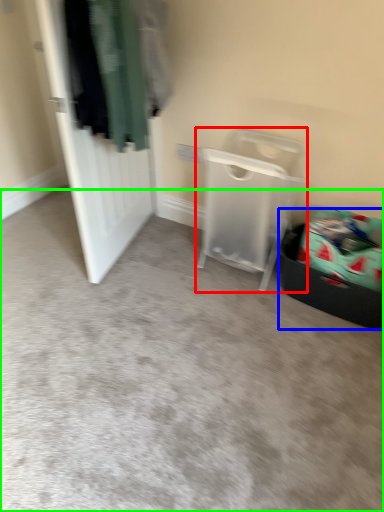
Question: Which object is positioned farthest from furniture (highlighted by a red box)? Select from laundry basket (highlighted by a blue box) and plain (highlighted by a green box).

Choices:
 (A) laundry basket
 (B) plain

Answer: (B)